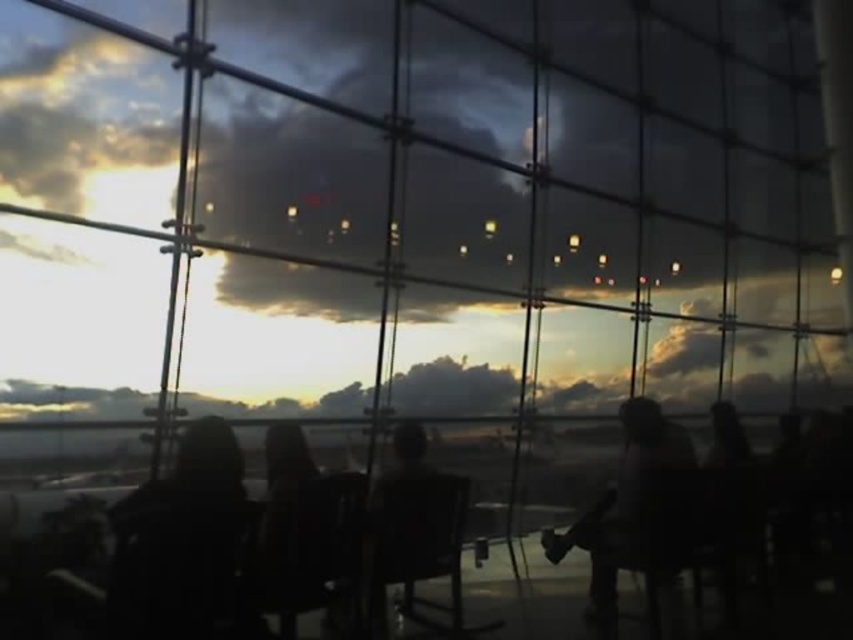
Between black matte jacket at left and silhouette figure at right, which one is positioned lower?

silhouette figure at right

Is black matte jacket at left wider than silhouette figure at right?

Incorrect, black matte jacket at left's width does not surpass silhouette figure at right's.

What do you see at coordinates (183, 547) in the screenshot? I see `black matte jacket at left` at bounding box center [183, 547].

At what (x,y) coordinates should I click in order to perform the action: click on black matte jacket at left. Please return your answer as a coordinate pair (x, y). Image resolution: width=853 pixels, height=640 pixels. Looking at the image, I should click on (183, 547).